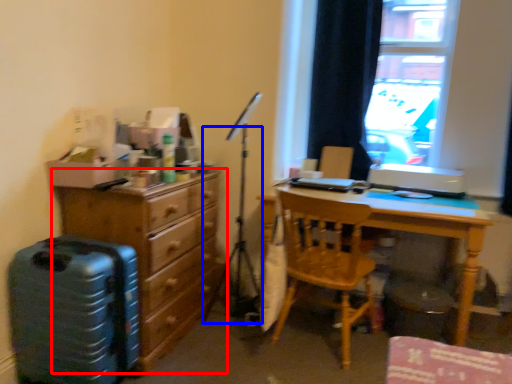
Question: Among these objects, which one is nearest to the camera, chest of drawers (highlighted by a red box) or tripod (highlighted by a blue box)?

Choices:
 (A) chest of drawers
 (B) tripod

Answer: (A)